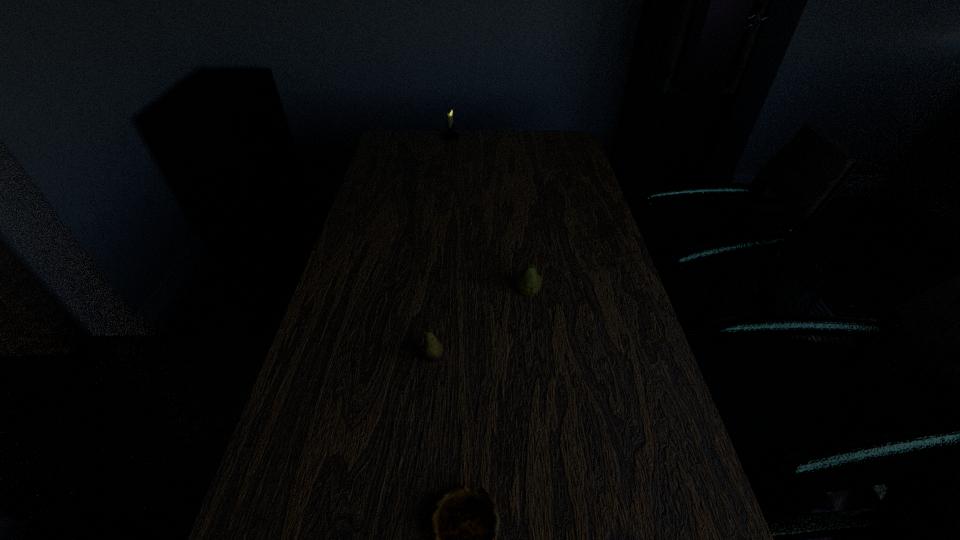
Image resolution: width=960 pixels, height=540 pixels. Identify the location of candle holder. (450, 135).

Where is `the third farthest object`? the third farthest object is located at coordinates (431, 351).

Where is `the nearer pear`? This screenshot has width=960, height=540. the nearer pear is located at coordinates (431, 351).

What are the coordinates of `the farther pear` in the screenshot? It's located at (529, 282).

The image size is (960, 540). I want to click on the right pear, so (529, 282).

This screenshot has height=540, width=960. Find the location of `vacant area situated 0.260m on the right of the candle holder`. vacant area situated 0.260m on the right of the candle holder is located at coordinates (524, 138).

Where is `free location located 0.170m on the right of the nearer pear`? This screenshot has width=960, height=540. free location located 0.170m on the right of the nearer pear is located at coordinates (519, 357).

Locate an element on the screen. The image size is (960, 540). blank area located 0.140m on the front of the rightmost object is located at coordinates (535, 345).

Locate an element on the screen. object present at the far edge is located at coordinates (450, 135).

In the image, there is a desktop. Where is `free space at the far edge`? This screenshot has height=540, width=960. free space at the far edge is located at coordinates tap(516, 137).